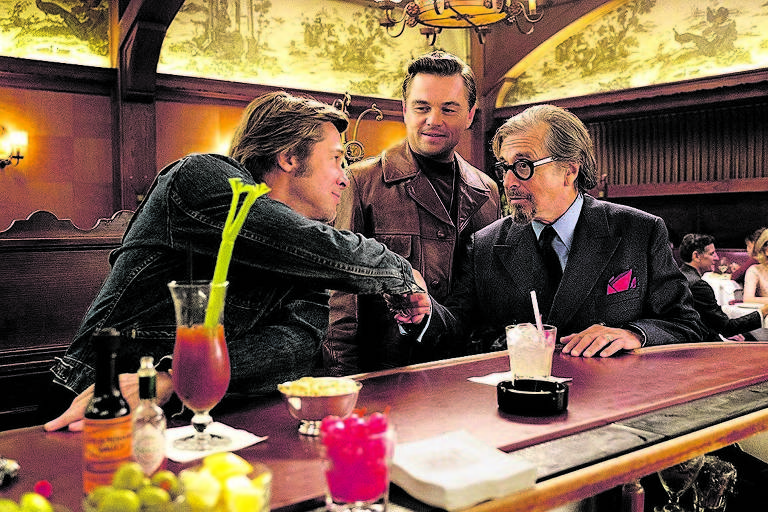
This screenshot has height=512, width=768. Find the location of `tall wine glass`. tall wine glass is located at coordinates (190, 303).